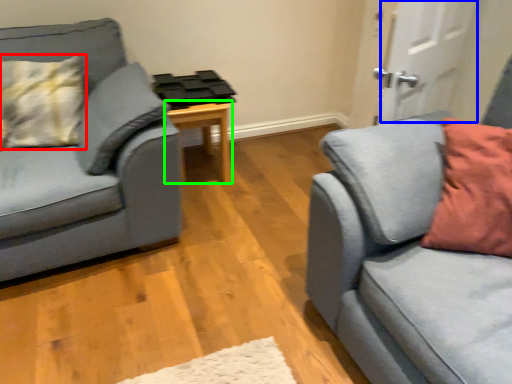
Question: Which object is positioned closest to pillow (highlighted by a red box)? Select from door (highlighted by a blue box) and table (highlighted by a green box).

Choices:
 (A) door
 (B) table

Answer: (B)